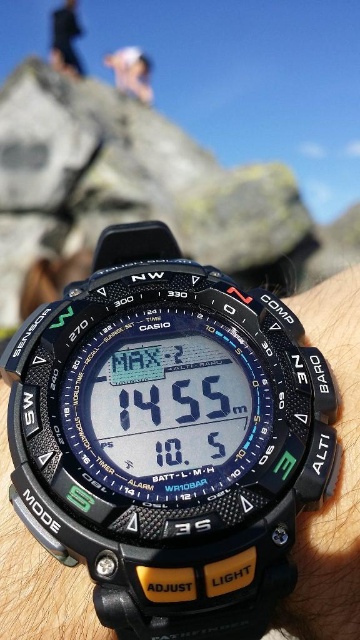
Question: Can you confirm if black fabric person at upper center is positioned above white fabric person at upper center?

Choices:
 (A) no
 (B) yes

Answer: (B)

Question: Is black rubber watch at lower right smaller than white fabric person at upper center?

Choices:
 (A) no
 (B) yes

Answer: (A)

Question: Estimate the real-world distances between objects in this image. Which object is closer to the white fabric person at upper center?

Choices:
 (A) black carbon fiber watch at center
 (B) black rubber watch at lower right

Answer: (B)

Question: Which of the following is the closest to the observer?

Choices:
 (A) black fabric person at upper center
 (B) white fabric person at upper center

Answer: (A)

Question: Does black carbon fiber watch at center appear over black rubber watch at lower right?

Choices:
 (A) yes
 (B) no

Answer: (A)

Question: Among these points, which one is farthest from the camera?

Choices:
 (A) (14, 484)
 (B) (348, 305)

Answer: (B)